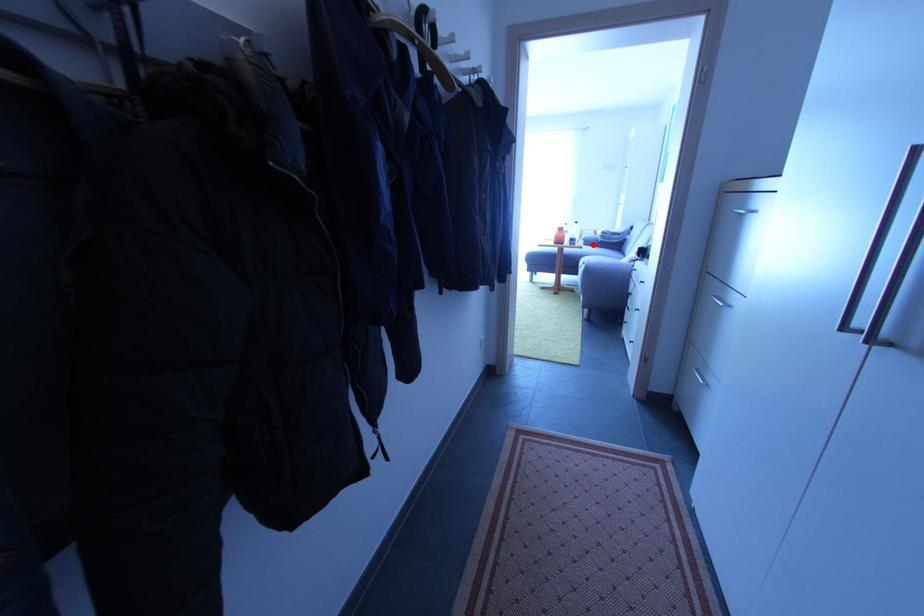
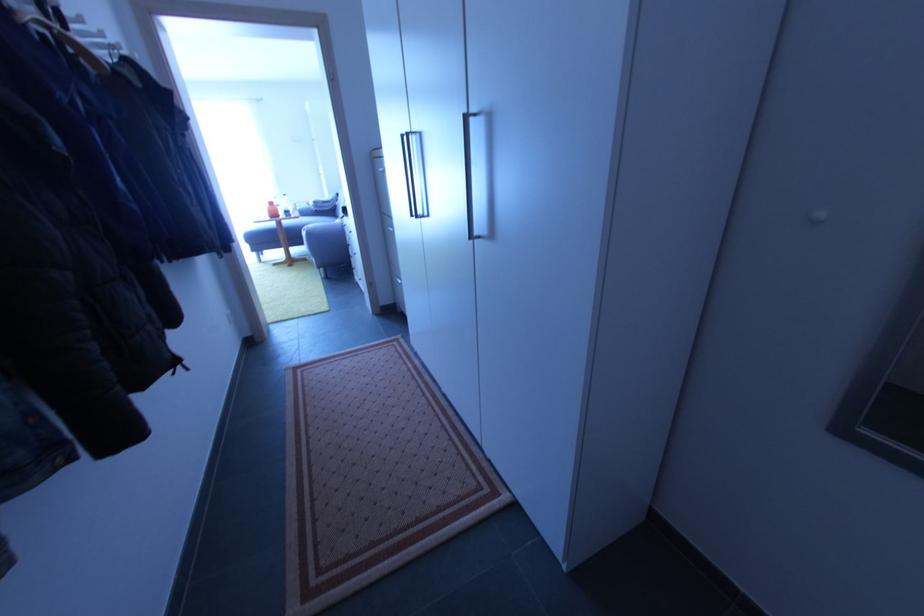
Question: I am providing you with two images of the same scene from different viewpoints. In image1, a red point is highlighted. Considering the same 3D point in image2, which of the following is correct?

Choices:
 (A) It is closer
 (B) It is farther

Answer: (A)